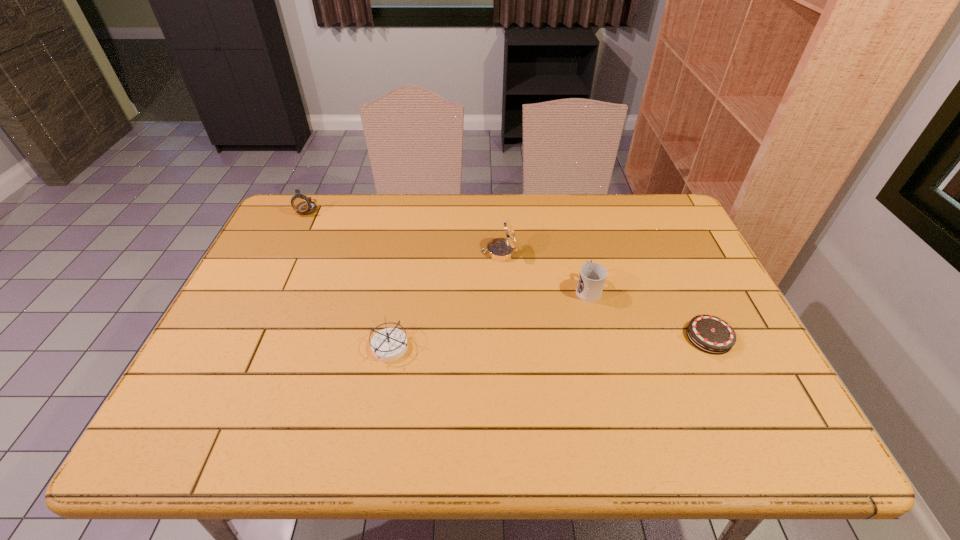
What are the coordinates of `object that can be found as the third closest to the chocolate cake` in the screenshot? It's located at (389, 344).

At what (x,y) coordinates should I click in order to perform the action: click on object identified as the second closest to the second shortest object. Please return your answer as a coordinate pair (x, y). Looking at the image, I should click on (592, 276).

Where is `compass that is the second closest to the second nearest compass`? compass that is the second closest to the second nearest compass is located at coordinates (302, 204).

Identify the location of compass that is the second closest to the fourth nearest object. (302, 204).

Locate an element on the screen. This screenshot has width=960, height=540. free space that satisfies the following two spatial constraints: 1. on the face of the farthest compass; 2. on the left side of the nearest compass is located at coordinates click(x=241, y=348).

Where is `free location that satisfies the following two spatial constraints: 1. with the dial facing the rightmost compass; 2. on the handle side of the second object from right to left`? free location that satisfies the following two spatial constraints: 1. with the dial facing the rightmost compass; 2. on the handle side of the second object from right to left is located at coordinates (501, 289).

The width and height of the screenshot is (960, 540). I want to click on blank area in the image that satisfies the following two spatial constraints: 1. with the dial facing the rightmost compass; 2. on the handle side of the third tallest object, so click(501, 289).

You are a GUI agent. You are given a task and a screenshot of the screen. Output one action in this format:
    pyautogui.click(x=<x>, y=<y>)
    Task: Click on the free space that satisfies the following two spatial constraints: 1. on the face of the leftmost object; 2. on the right side of the chocolate cake
    
    Given the screenshot: What is the action you would take?
    246,337

The width and height of the screenshot is (960, 540). Find the location of `free spot that satisfies the following two spatial constraints: 1. on the face of the rightmost object; 2. on the left side of the leftmost object`. free spot that satisfies the following two spatial constraints: 1. on the face of the rightmost object; 2. on the left side of the leftmost object is located at coordinates (246, 337).

You are a GUI agent. You are given a task and a screenshot of the screen. Output one action in this format:
    pyautogui.click(x=<x>, y=<y>)
    Task: Click on the free space that satisfies the following two spatial constraints: 1. with the dial facing the rightmost compass; 2. on the handle side of the third tallest object
    Image resolution: width=960 pixels, height=540 pixels.
    Given the screenshot: What is the action you would take?
    pyautogui.click(x=501, y=289)